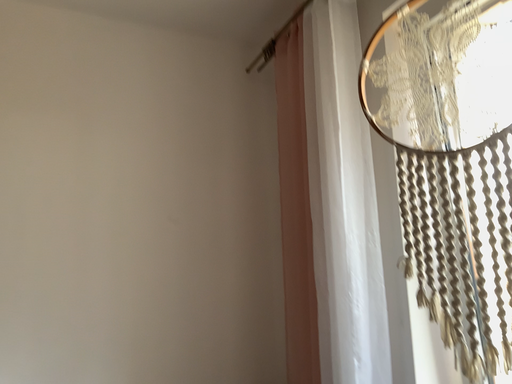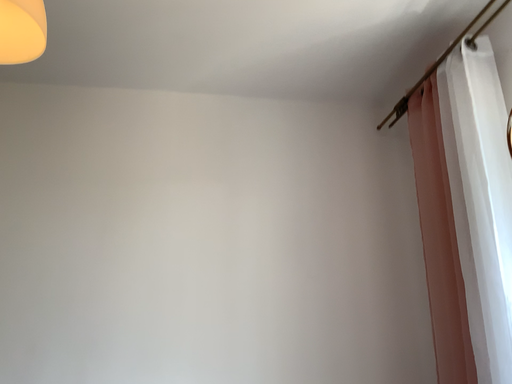
Question: Which way did the camera rotate in the video?

Choices:
 (A) rotated downward
 (B) rotated upward

Answer: (B)